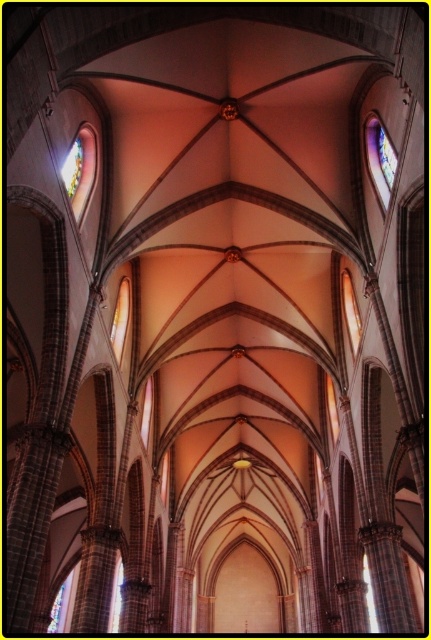
You are an architect assessing the cathedral design. You need to install a new lighting fixture between the multicolored stained glass at upper right and the multicolored stained glass at upper left. Which stained glass has a wider space available for installation?

The multicolored stained glass at upper right has a wider space available for installation because its width surpasses that of the multicolored stained glass at upper left.

You are standing at the entrance of the cathedral and looking towards the altar. Where is the multicolored stained glass at upper right located in relation to your position?

The multicolored stained glass at upper right is located at the upper right section of the cathedral, positioned at coordinates point (380,157) relative to your viewpoint.